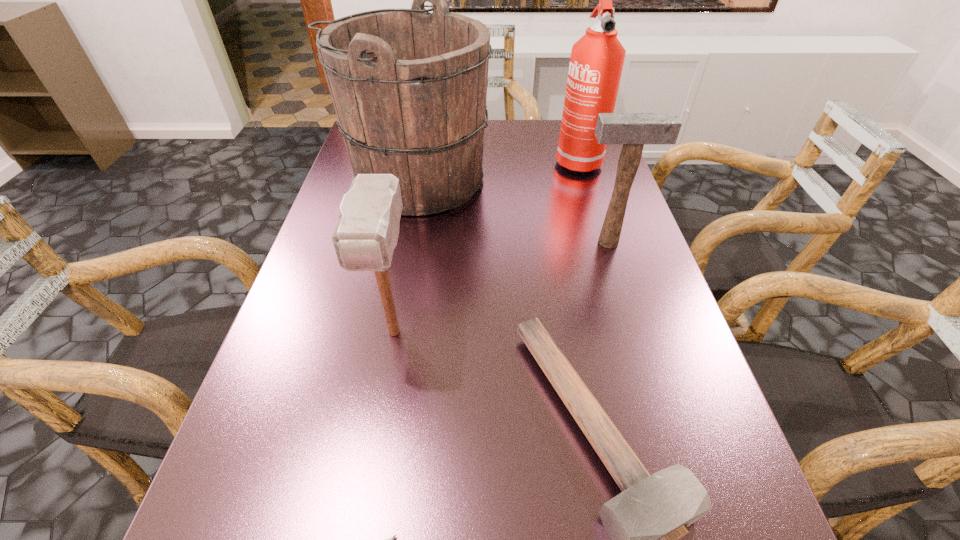
Locate an element on the screen. fire extinguisher is located at coordinates (596, 63).

Locate an element on the screen. Image resolution: width=960 pixels, height=540 pixels. bucket is located at coordinates (409, 87).

Where is `the third farthest object`? Image resolution: width=960 pixels, height=540 pixels. the third farthest object is located at coordinates (633, 130).

Where is `the leftmost mallet`? The width and height of the screenshot is (960, 540). the leftmost mallet is located at coordinates (367, 230).

This screenshot has height=540, width=960. Find the location of `free region located at the nozzle of the fire extinguisher`. free region located at the nozzle of the fire extinguisher is located at coordinates (614, 285).

Locate an element on the screen. The width and height of the screenshot is (960, 540). vacant space located 0.310m on the front of the bucket is located at coordinates (388, 326).

At what (x,y) coordinates should I click in order to perform the action: click on vacant space located 0.220m on the front of the farthest mallet. Please return your answer as a coordinate pair (x, y). This screenshot has height=540, width=960. Looking at the image, I should click on pyautogui.click(x=635, y=327).

The image size is (960, 540). In order to click on vacant space located 0.110m on the striking face of the leftmost mallet in this screenshot , I will do `click(378, 427)`.

Find the location of a particular element. fire extinguisher at the far edge is located at coordinates (596, 63).

Find the location of a particular element. The image size is (960, 540). bucket present at the far edge is located at coordinates click(x=409, y=87).